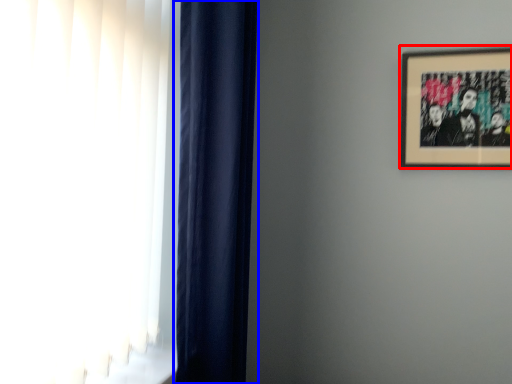
Question: Among these objects, which one is farthest to the camera, picture frame (highlighted by a red box) or curtain (highlighted by a blue box)?

Choices:
 (A) picture frame
 (B) curtain

Answer: (A)